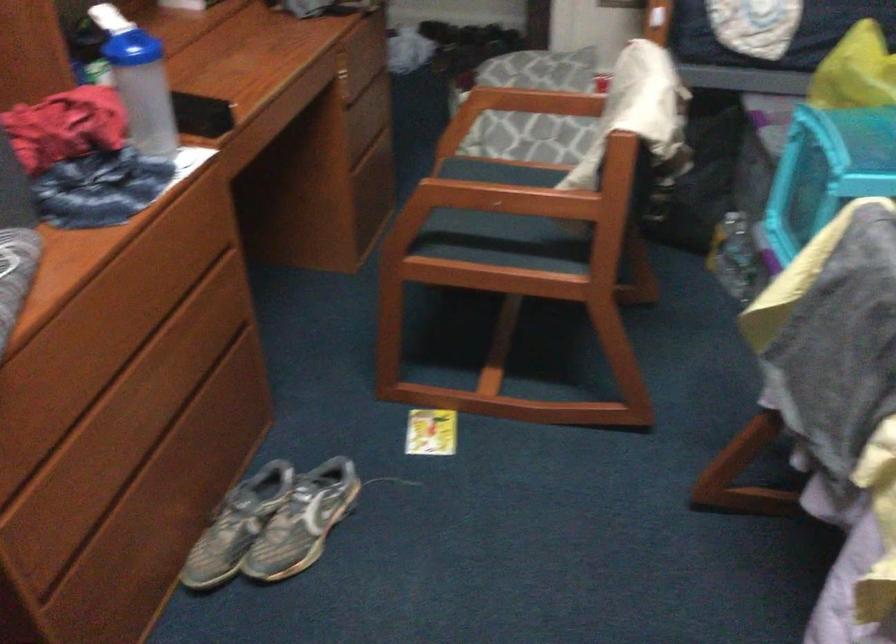
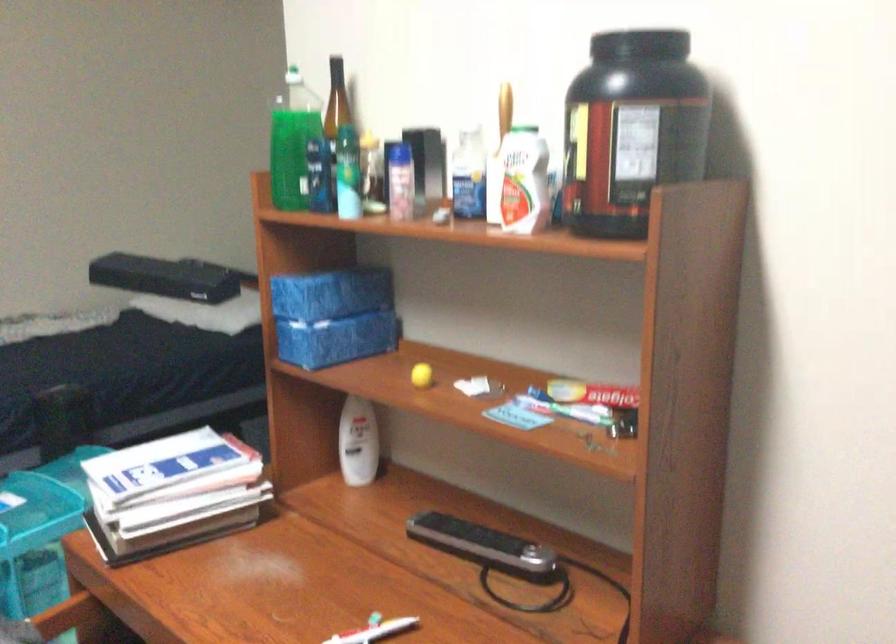
Question: How did the camera likely rotate?

Choices:
 (A) Left
 (B) Right
 (C) Up
 (D) Down

Answer: (B)